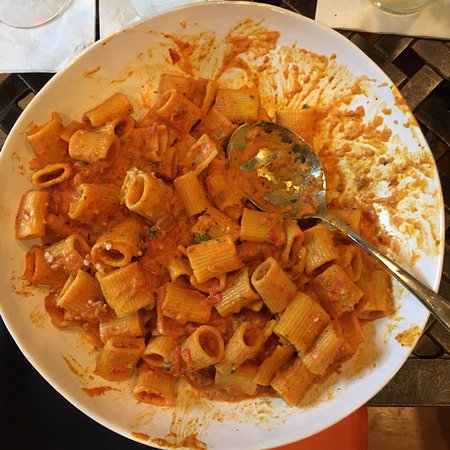
This screenshot has width=450, height=450. I want to click on water glass, so click(x=401, y=7).